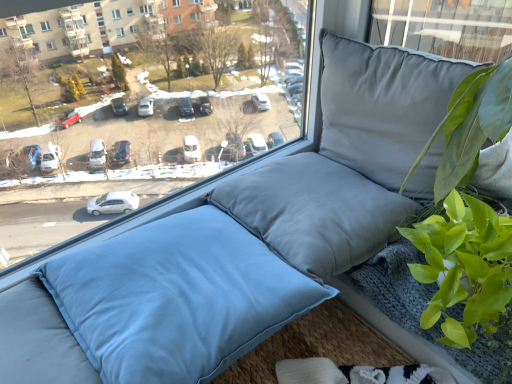
Locate an element on the screen. The height and width of the screenshot is (384, 512). free spot above light blue fabric pillow at center, which is the 3th pillow from top to bottom (from a real-world perspective) is located at coordinates (178, 269).